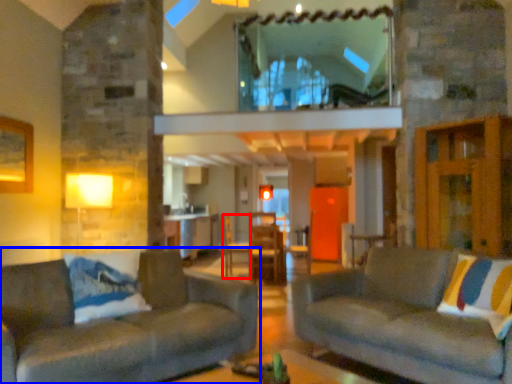
Question: Among these objects, which one is farthest to the camera, armchair (highlighted by a red box) or studio couch (highlighted by a blue box)?

Choices:
 (A) armchair
 (B) studio couch

Answer: (A)